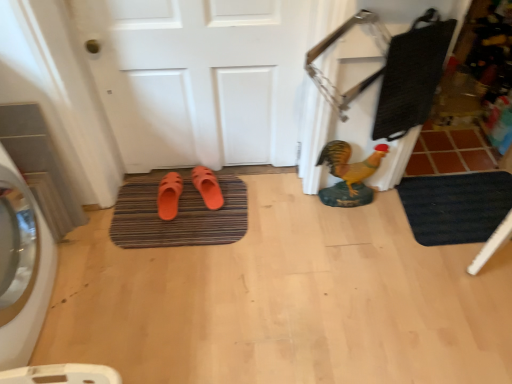
At what (x,y) coordinates should I click in order to perform the action: click on vacant area that is situated to the right of orange rubber slipper at center, marked as the 2th footwear in a right-to-left arrangement. Please return your answer as a coordinate pair (x, y). Looking at the image, I should click on (205, 208).